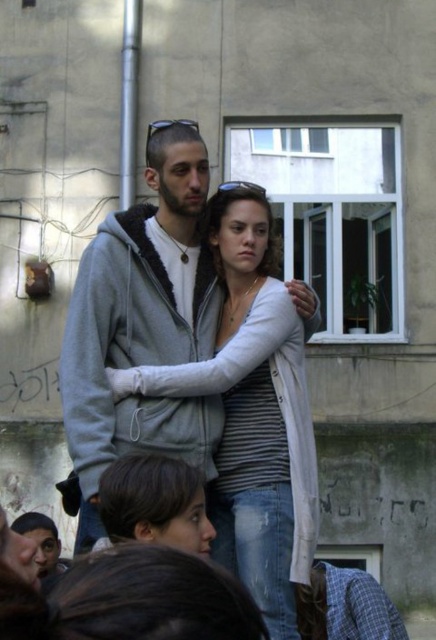
You are a tailor measuring two garments in the image. The striped knit sweater at center and the gray fleece sweatshirt at center. Which one is taller?

The striped knit sweater at center is taller than the gray fleece sweatshirt at center.